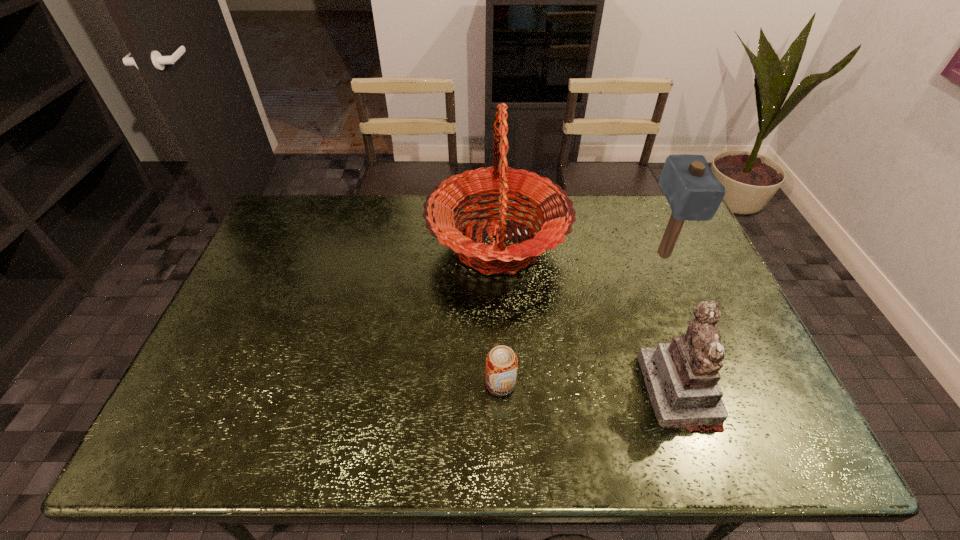
This screenshot has height=540, width=960. Identify the location of vacant space that's between the shortest object and the figurine. (589, 388).

At what (x,y) coordinates should I click in order to perform the action: click on empty space that is in between the beer can and the mallet. Please return your answer as a coordinate pair (x, y). Image resolution: width=960 pixels, height=540 pixels. Looking at the image, I should click on coord(582,319).

The width and height of the screenshot is (960, 540). Identify the location of the third closest object to the tallest object. (693, 192).

Locate which object is the second closest to the tallest object. Please provide its 2D coordinates. Your answer should be formatted as a tuple, i.e. [(x, y)], where the tuple contains the x and y coordinates of a point satisfying the conditions above.

[(501, 362)]

I want to click on vacant space that satisfies the following two spatial constraints: 1. on the back side of the mallet; 2. on the left side of the shortest object, so [x=495, y=254].